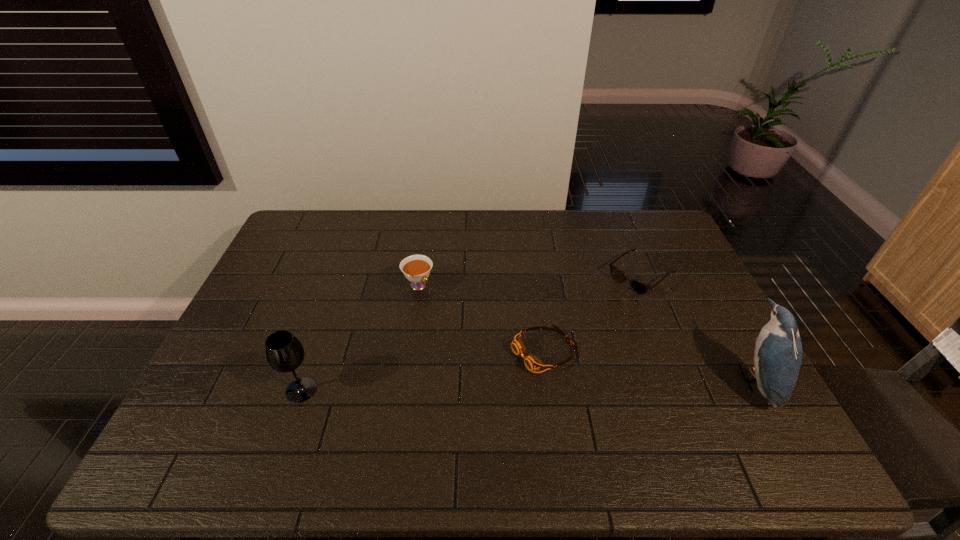
Where is `vacant space at the near right corner of the desktop`? Image resolution: width=960 pixels, height=540 pixels. vacant space at the near right corner of the desktop is located at coordinates (770, 415).

You are a GUI agent. You are given a task and a screenshot of the screen. Output one action in this format:
    pyautogui.click(x=<x>, y=<y>)
    Task: Click on the vacant area that lies between the third object from right to left and the second tallest object
    The height and width of the screenshot is (540, 960).
    Given the screenshot: What is the action you would take?
    pyautogui.click(x=421, y=370)

Where is `unoccupied area between the bird and the third object from right to left`? This screenshot has height=540, width=960. unoccupied area between the bird and the third object from right to left is located at coordinates (648, 365).

Find the location of a particular element. vacant space in between the tallest object and the third tallest object is located at coordinates (586, 333).

What are the coordinates of `free space between the third object from right to left and the second object from right to left` in the screenshot? It's located at (591, 313).

The height and width of the screenshot is (540, 960). What are the coordinates of `free space between the teacup and the second tallest object` in the screenshot? It's located at (360, 338).

The height and width of the screenshot is (540, 960). In order to click on empty location between the fourth shortest object and the second object from left to right in this screenshot , I will do `click(360, 338)`.

Where is `free spot between the third object from right to left and the second object from right to left`? free spot between the third object from right to left and the second object from right to left is located at coordinates (591, 313).

Locate an element on the screen. This screenshot has width=960, height=540. empty space that is in between the goggles and the fourth object from right to left is located at coordinates (480, 318).

Identify the location of free area in between the sunglasses and the tallest object. (697, 328).